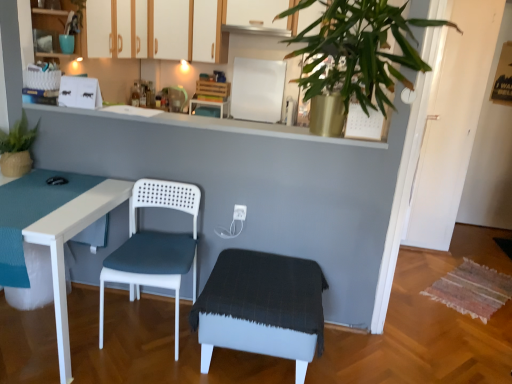
Identify the location of free area in between white plastic chair at center and white matte table at left. (119, 367).